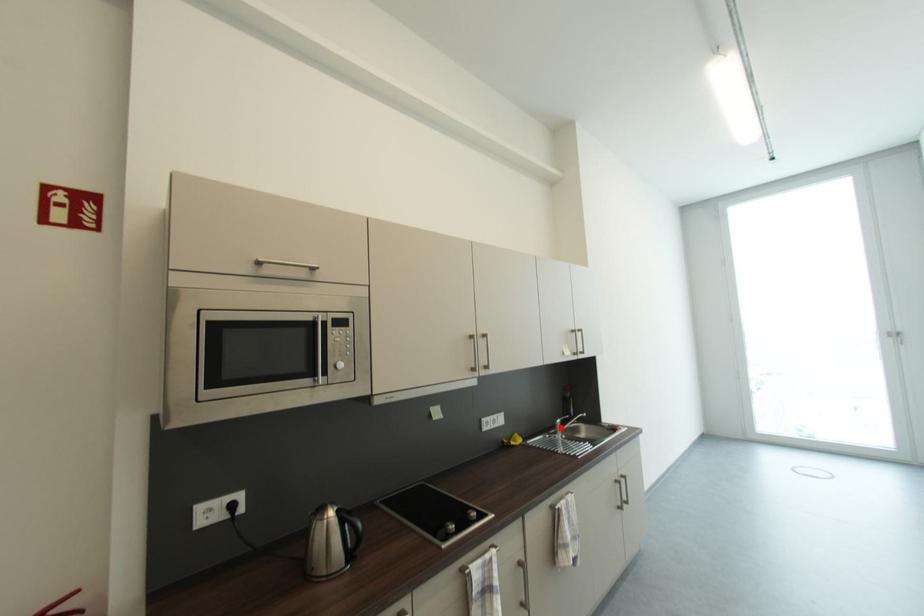
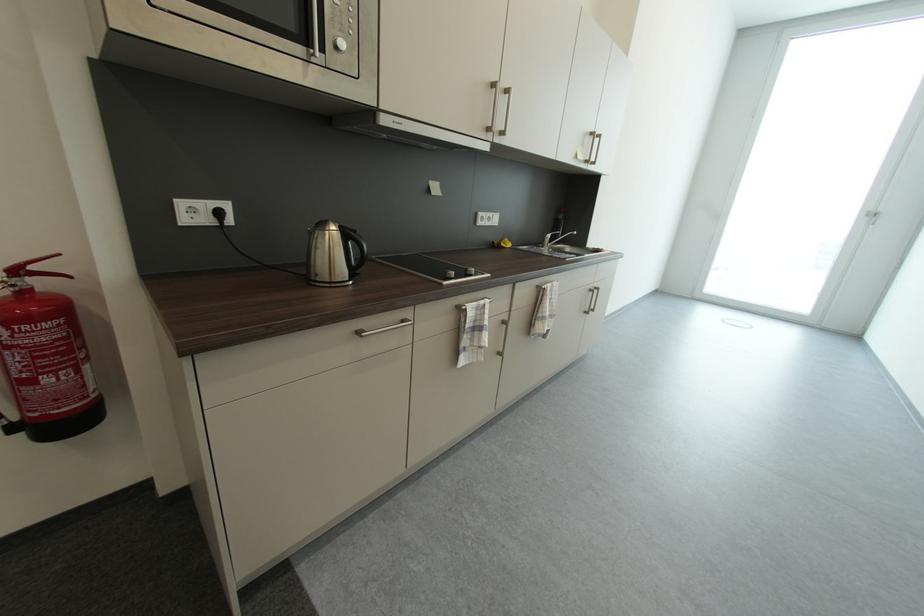
In the second image, find the point that corresponds to the highlighted location in the first image.

(550, 241)